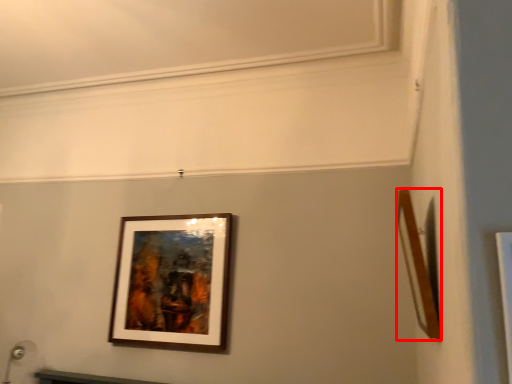
Question: Considering the relative positions of picture frame (annotated by the red box) and picture frame in the image provided, where is picture frame (annotated by the red box) located with respect to the staircase?

Choices:
 (A) right
 (B) left

Answer: (A)